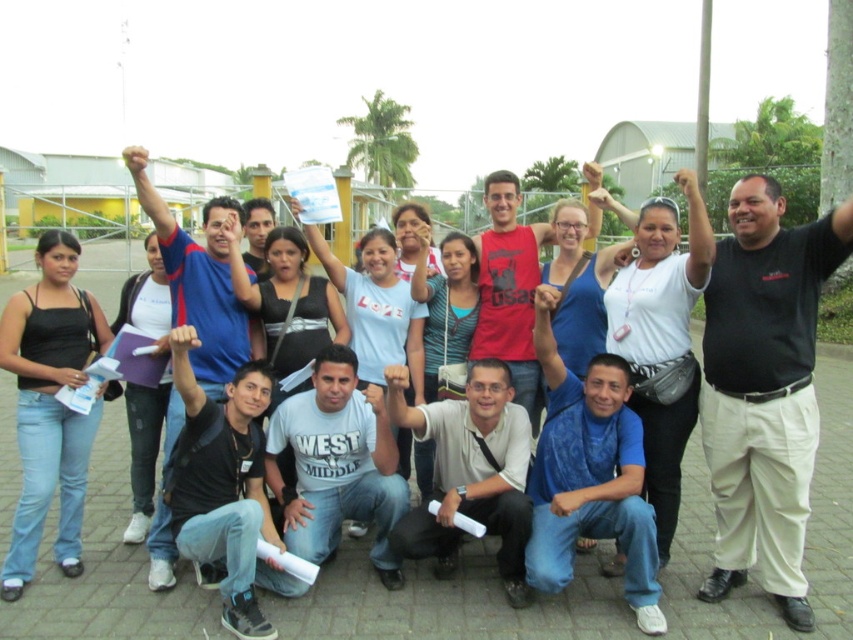
Which of these two, blue cotton shirt at center or blue fabric shirt at upper center, stands shorter?

blue cotton shirt at center is shorter.

You are a GUI agent. You are given a task and a screenshot of the screen. Output one action in this format:
    pyautogui.click(x=<x>, y=<y>)
    Task: Click on the blue cotton shirt at center
    
    Given the screenshot: What is the action you would take?
    pyautogui.click(x=589, y=474)

Can you confirm if black cotton shirt at center is positioned to the left of white cotton shirt at center?

No, black cotton shirt at center is not to the left of white cotton shirt at center.

Which of these two, black cotton shirt at center or white cotton shirt at center, stands shorter?

Standing shorter between the two is white cotton shirt at center.

Is point (767, 240) farther from camera compared to point (349, 474)?

No, it is not.

At what (x,y) coordinates should I click in order to perform the action: click on black cotton shirt at center. Please return your answer as a coordinate pair (x, y). Looking at the image, I should click on (764, 388).

Is point (366, 403) closer to camera compared to point (206, 236)?

No, it is not.

Who is more distant from viewer, (x=273, y=412) or (x=194, y=256)?

Positioned behind is point (x=273, y=412).

Is point (379, 568) more distant than point (190, 364)?

No, it is in front of (190, 364).

Where is `white cotton shirt at center`? white cotton shirt at center is located at coordinates (337, 464).